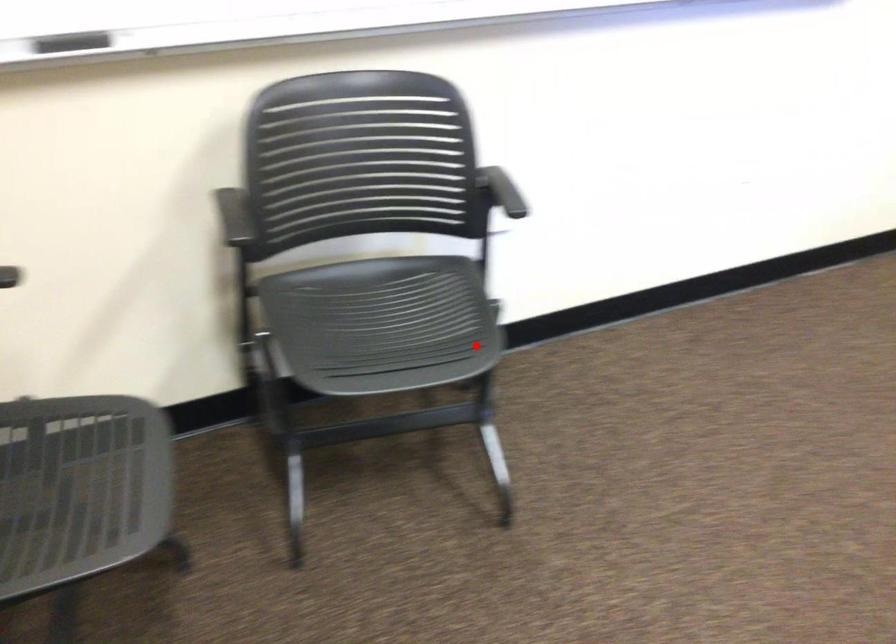
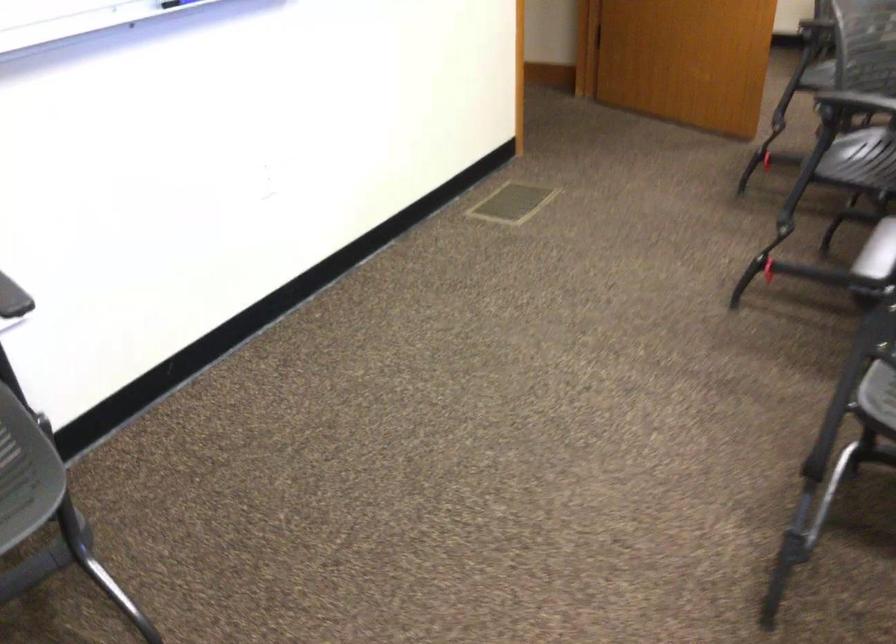
The point at the highlighted location is marked in the first image. Where is the corresponding point in the second image?

(26, 473)